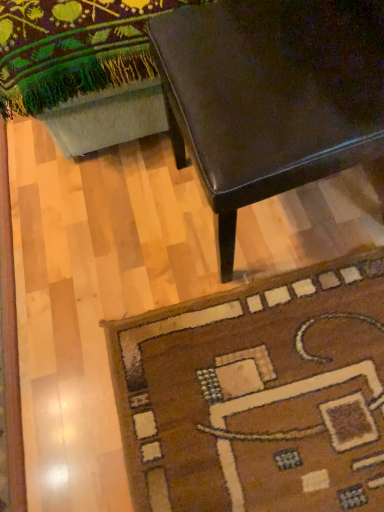
Question: In the image, is shiny dark brown table at upper right positioned in front of or behind brown woolen rug at lower right?

Choices:
 (A) front
 (B) behind

Answer: (A)

Question: Based on their sizes in the image, would you say shiny dark brown table at upper right is bigger or smaller than brown woolen rug at lower right?

Choices:
 (A) small
 (B) big

Answer: (B)

Question: From their relative heights in the image, would you say shiny dark brown table at upper right is taller or shorter than brown woolen rug at lower right?

Choices:
 (A) tall
 (B) short

Answer: (A)

Question: Relative to shiny dark brown table at upper right, is brown woolen rug at lower right in front or behind?

Choices:
 (A) behind
 (B) front

Answer: (A)

Question: Is brown woolen rug at lower right inside or outside of shiny dark brown table at upper right?

Choices:
 (A) inside
 (B) outside

Answer: (B)

Question: Based on their positions, is brown woolen rug at lower right located to the left or right of shiny dark brown table at upper right?

Choices:
 (A) right
 (B) left

Answer: (B)

Question: Looking at the image, does brown woolen rug at lower right seem bigger or smaller compared to shiny dark brown table at upper right?

Choices:
 (A) small
 (B) big

Answer: (A)